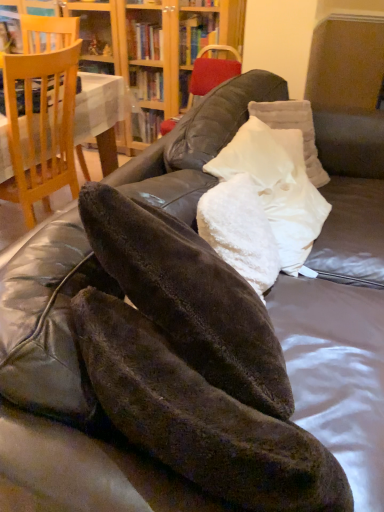
Question: Considering the positions of light brown wooden chair at left and white fluffy pillow at center, marked as the first pillow in a front-to-back arrangement, in the image, is light brown wooden chair at left taller or shorter than white fluffy pillow at center, marked as the first pillow in a front-to-back arrangement,?

Choices:
 (A) tall
 (B) short

Answer: (A)

Question: In terms of width, does light brown wooden chair at left look wider or thinner when compared to white fluffy pillow at center, the third pillow positioned from the back?

Choices:
 (A) thin
 (B) wide

Answer: (B)

Question: Which of these objects is positioned farthest from the white fluffy pillow at center, marked as the first pillow in a front-to-back arrangement?

Choices:
 (A) white fluffy pillow at center, which is the second pillow from front to back
 (B) wooden bookcase at upper center
 (C) light brown wooden chair at left
 (D) white fluffy pillow at center, acting as the 3th pillow starting from the front

Answer: (B)

Question: Estimate the real-world distances between objects in this image. Which object is farther from the wooden bookcase at upper center?

Choices:
 (A) light brown wooden chair at left
 (B) white fluffy pillow at center, the third pillow positioned from the back
 (C) white fluffy pillow at center, the 2th pillow when ordered from back to front
 (D) white fluffy pillow at center, the first pillow when ordered from back to front

Answer: (B)